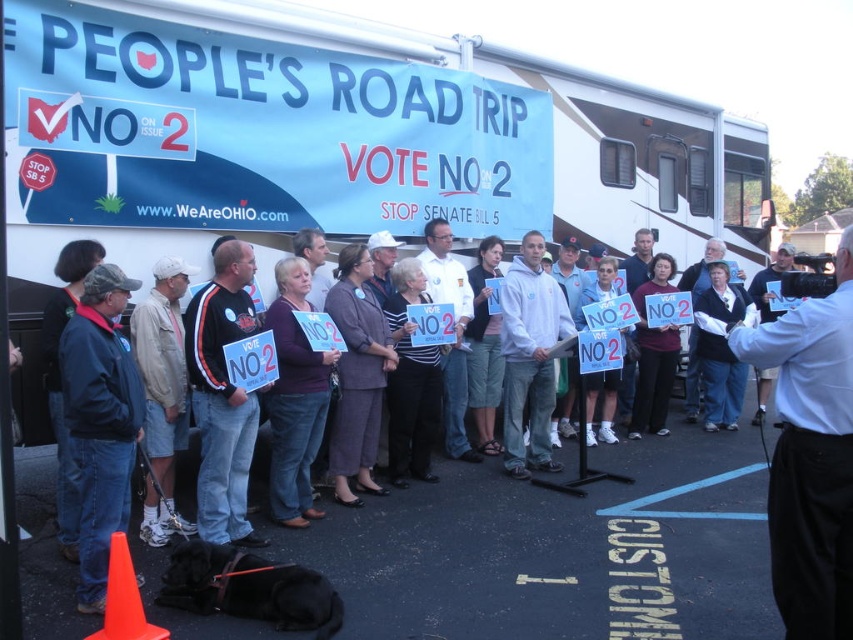
Question: Can you confirm if white shirt at center is positioned to the right of denim jacket at left?

Choices:
 (A) no
 (B) yes

Answer: (B)

Question: Is the position of white shirt at center less distant than that of denim jacket at left?

Choices:
 (A) yes
 (B) no

Answer: (A)

Question: Among these objects, which one is farthest from the camera?

Choices:
 (A) denim jacket at left
 (B) white shirt at center

Answer: (A)

Question: Is white shirt at center positioned before denim jacket at left?

Choices:
 (A) no
 (B) yes

Answer: (B)